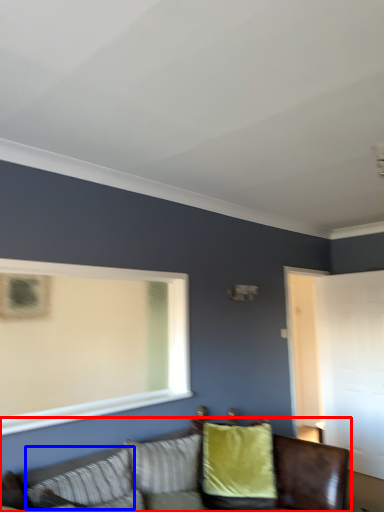
Question: Which object is closer to the camera taking this photo, studio couch (highlighted by a red box) or pillow (highlighted by a blue box)?

Choices:
 (A) studio couch
 (B) pillow

Answer: (A)